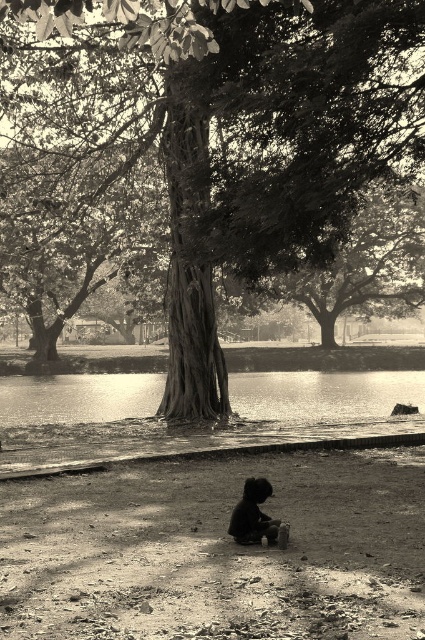
Which is more to the left, sepia textured tree at center or glistening water at center?

sepia textured tree at center is more to the left.

Who is more distant from viewer, (241, 58) or (391, 394)?

Positioned behind is point (391, 394).

Does point (127, 49) lie behind point (286, 390)?

That is False.

The image size is (425, 640). Identify the location of sepia textured tree at center. (261, 134).

Does glistening water at center appear on the right side of smooth bark tree at center?

No, glistening water at center is not to the right of smooth bark tree at center.

Can you confirm if glistening water at center is positioned above smooth bark tree at center?

Actually, glistening water at center is below smooth bark tree at center.

This screenshot has height=640, width=425. What do you see at coordinates (323, 396) in the screenshot? I see `glistening water at center` at bounding box center [323, 396].

This screenshot has width=425, height=640. What are the coordinates of `glistening water at center` in the screenshot? It's located at (323, 396).

Image resolution: width=425 pixels, height=640 pixels. Describe the element at coordinates (261, 134) in the screenshot. I see `sepia textured tree at center` at that location.

Between sepia textured tree at center and smooth bark tree at center, which one has more height?

sepia textured tree at center

What do you see at coordinates (261, 134) in the screenshot? The image size is (425, 640). I see `sepia textured tree at center` at bounding box center [261, 134].

Locate an element on the screen. The height and width of the screenshot is (640, 425). sepia textured tree at center is located at coordinates (261, 134).